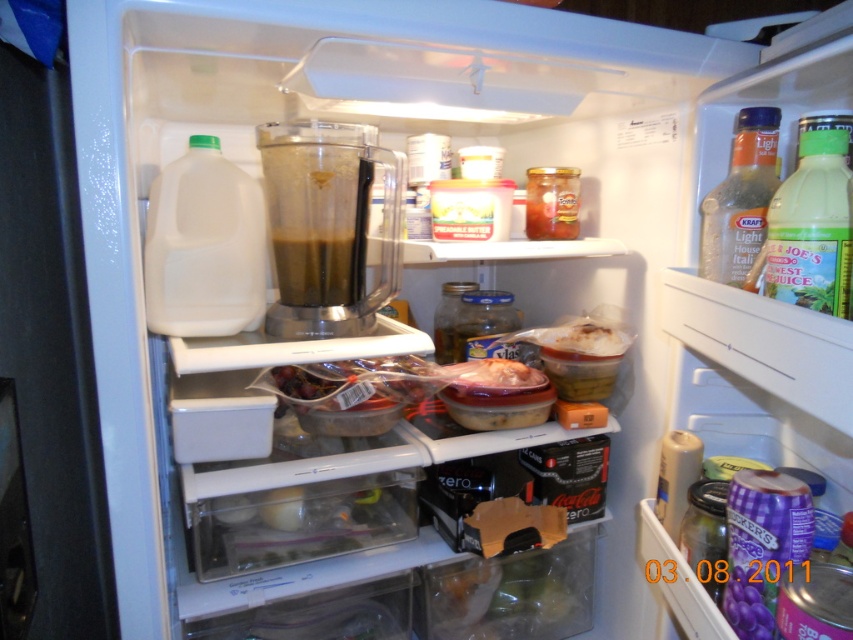
Question: Is green plastic bottle at upper right bigger than dark brown liquid at center?

Choices:
 (A) yes
 (B) no

Answer: (A)

Question: Among these points, which one is nearest to the camera?

Choices:
 (A) (213, 156)
 (B) (714, 273)

Answer: (B)

Question: Observing the image, what is the correct spatial positioning of white matte plastic milk at left in reference to translucent plastic bottle at upper right?

Choices:
 (A) below
 (B) above

Answer: (A)

Question: Which point is farther to the camera?

Choices:
 (A) white matte plastic milk at left
 (B) translucent plastic bottle at upper right

Answer: (A)

Question: Estimate the real-world distances between objects in this image. Which object is farther from the dark brown liquid at center?

Choices:
 (A) green plastic bottle at upper right
 (B) white matte plastic milk at left

Answer: (A)

Question: Can you confirm if transparent plastic blender at center is smaller than translucent plastic bottle at upper right?

Choices:
 (A) no
 (B) yes

Answer: (A)